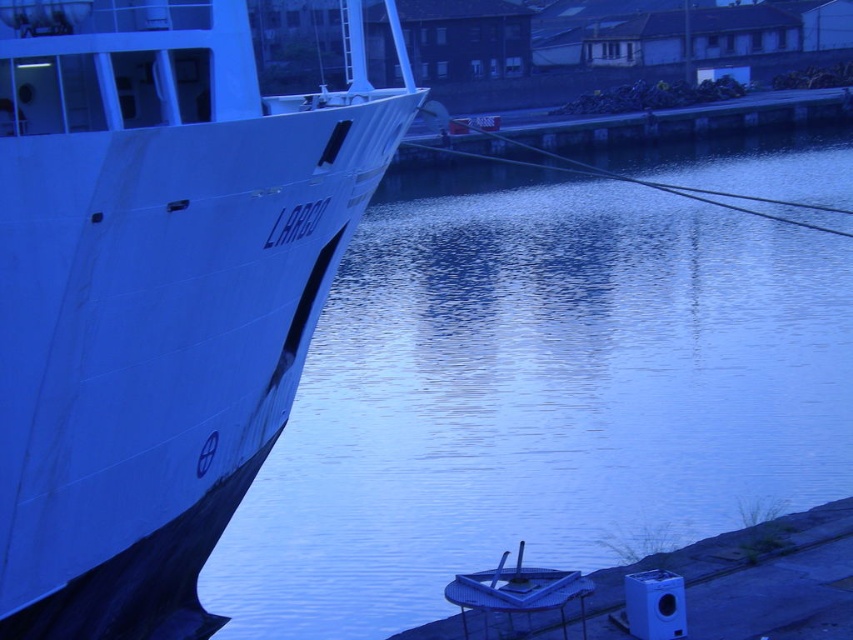
You are a photographer trying to capture the reflection of the ship LARGO in the glossy water at center. Based on the water location, where should you position your camera to ensure the reflection is centered in your shot?

The glossy water at center is located at point 2D coordinates of (x=537, y=396). To center the reflection of the ship LARGO in the shot, position the camera directly above or aligned with this coordinate point so the reflection is captured centrally.

You are a delivery drone with a wingspan of 1.5 meters. You need to fly from the glossy water at center to the white matte ship at left. Is there enough space between them for your drone to pass safely?

The distance between the glossy water at center and the white matte ship at left is 12.75 meters. Since your drone has a wingspan of 1.5 meters, there is ample space for it to pass safely between them.